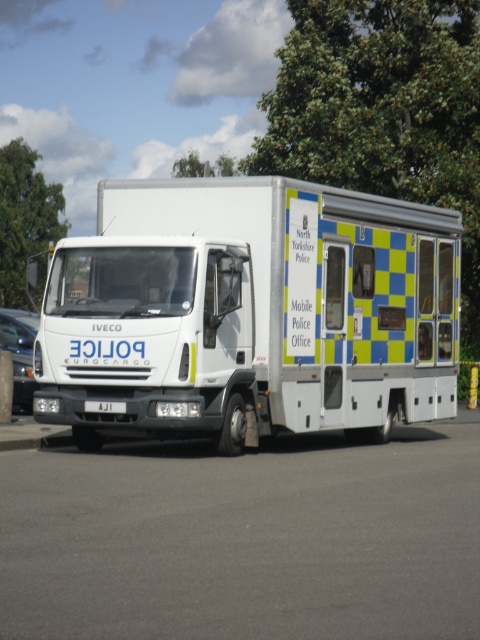
Question: Among these points, which one is nearest to the camera?

Choices:
 (A) (351, 305)
 (B) (33, 340)
 (C) (243, 577)

Answer: (C)

Question: Which object is the closest to the gray asphalt parking lot at center?

Choices:
 (A) white glossy truck at center
 (B) white plastic license plate at front
 (C) green leafy tree at upper left

Answer: (B)

Question: Can you confirm if white glossy truck at center is wider than white glossy van at left?

Choices:
 (A) no
 (B) yes

Answer: (A)

Question: Can you confirm if gray asphalt parking lot at center is thinner than white plastic license plate at front?

Choices:
 (A) yes
 (B) no

Answer: (B)

Question: Is white glossy van at left thinner than white plastic license plate at front?

Choices:
 (A) no
 (B) yes

Answer: (A)

Question: Which point is closer to the camera?

Choices:
 (A) white plastic license plate at front
 (B) gray asphalt parking lot at center
 (C) green leafy tree at upper center

Answer: (B)